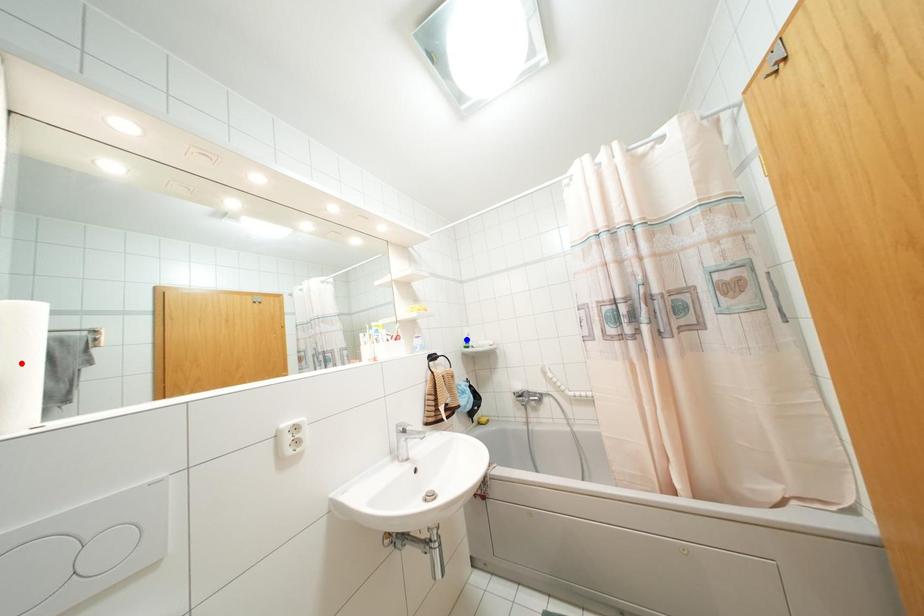
Question: In the image, two points are highlighted. Which point is nearer to the camera? Reply with the corresponding letter.

Choices:
 (A) blue point
 (B) red point

Answer: (B)